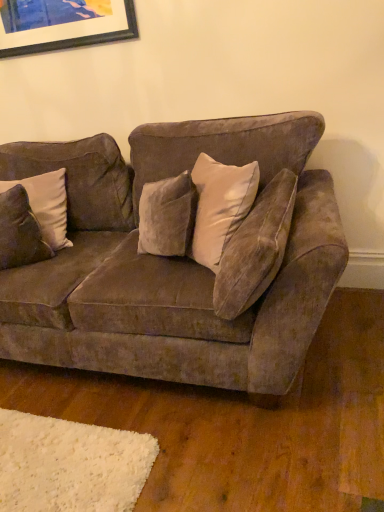
Question: Are velvet brown couch at center and velvet brown pillow at left far apart?

Choices:
 (A) yes
 (B) no

Answer: (B)

Question: From the image's perspective, is velvet brown couch at center above velvet brown pillow at left?

Choices:
 (A) yes
 (B) no

Answer: (B)

Question: Could you tell me if velvet brown couch at center is facing velvet brown pillow at left?

Choices:
 (A) yes
 (B) no

Answer: (A)

Question: Considering the relative sizes of velvet brown couch at center and velvet brown pillow at left in the image provided, is velvet brown couch at center shorter than velvet brown pillow at left?

Choices:
 (A) yes
 (B) no

Answer: (B)

Question: Considering the relative sizes of velvet brown couch at center and velvet brown pillow at left in the image provided, is velvet brown couch at center thinner than velvet brown pillow at left?

Choices:
 (A) no
 (B) yes

Answer: (A)

Question: In the image, is matte black picture frame at upper left on the left side or the right side of velvet brown pillow at left?

Choices:
 (A) left
 (B) right

Answer: (B)

Question: Is point (112, 28) positioned closer to the camera than point (28, 184)?

Choices:
 (A) closer
 (B) farther

Answer: (B)

Question: Based on their sizes in the image, would you say matte black picture frame at upper left is bigger or smaller than velvet brown pillow at left?

Choices:
 (A) big
 (B) small

Answer: (B)

Question: Is matte black picture frame at upper left in front of or behind velvet brown pillow at left in the image?

Choices:
 (A) behind
 (B) front

Answer: (A)

Question: From the image's perspective, is velvet brown pillow at left located above or below matte black picture frame at upper left?

Choices:
 (A) below
 (B) above

Answer: (A)

Question: Choose the correct answer: Is velvet brown pillow at left inside matte black picture frame at upper left or outside it?

Choices:
 (A) outside
 (B) inside

Answer: (A)

Question: Looking at their shapes, would you say velvet brown pillow at left is wider or thinner than matte black picture frame at upper left?

Choices:
 (A) thin
 (B) wide

Answer: (B)

Question: Considering the positions of velvet brown pillow at left and matte black picture frame at upper left in the image, is velvet brown pillow at left taller or shorter than matte black picture frame at upper left?

Choices:
 (A) short
 (B) tall

Answer: (B)

Question: From a real-world perspective, is velvet brown couch at center physically located above or below matte black picture frame at upper left?

Choices:
 (A) above
 (B) below

Answer: (B)

Question: Considering the positions of point (86, 218) and point (117, 0), is point (86, 218) closer or farther from the camera than point (117, 0)?

Choices:
 (A) closer
 (B) farther

Answer: (B)